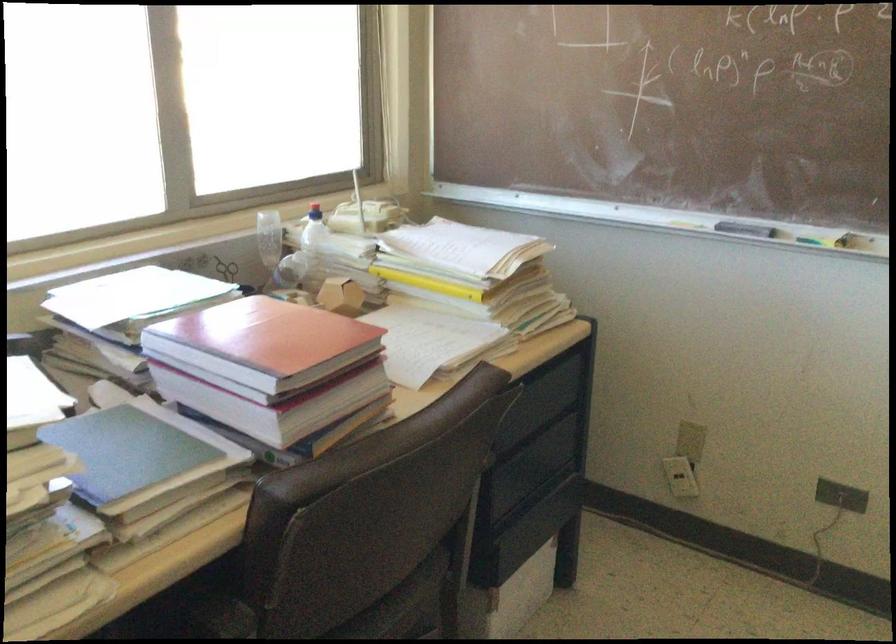
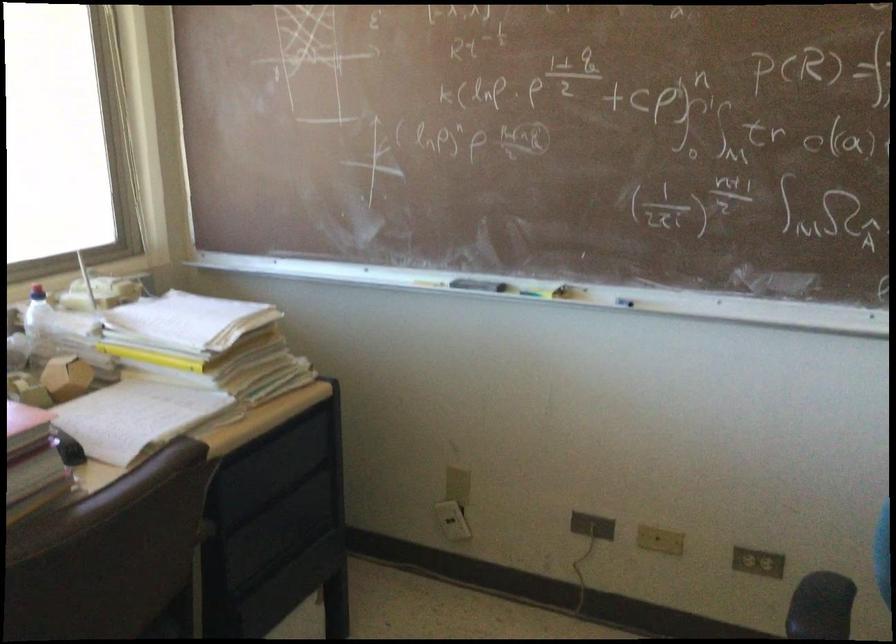
Find the pixel in the second image that matches (x=419, y=334) in the first image.

(135, 417)